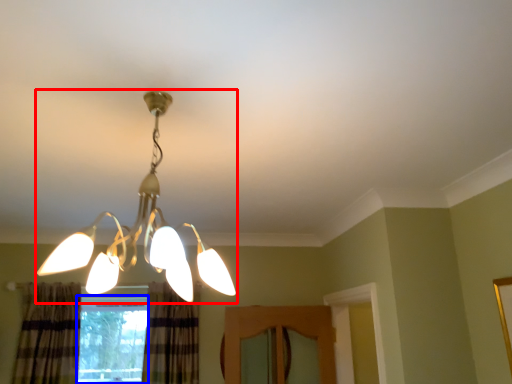
Question: Which point is closer to the camera, lamp (highlighted by a red box) or window (highlighted by a blue box)?

Choices:
 (A) lamp
 (B) window

Answer: (A)